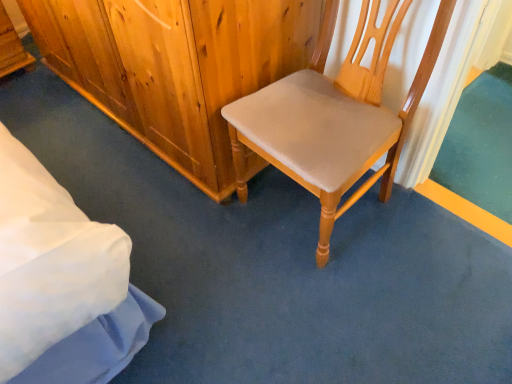
You are a GUI agent. You are given a task and a screenshot of the screen. Output one action in this format:
    pyautogui.click(x=<x>, y=<y>)
    Task: Click on the free region under light brown wood chair at center (from a real-world perspective)
    
    Given the screenshot: What is the action you would take?
    pyautogui.click(x=291, y=206)